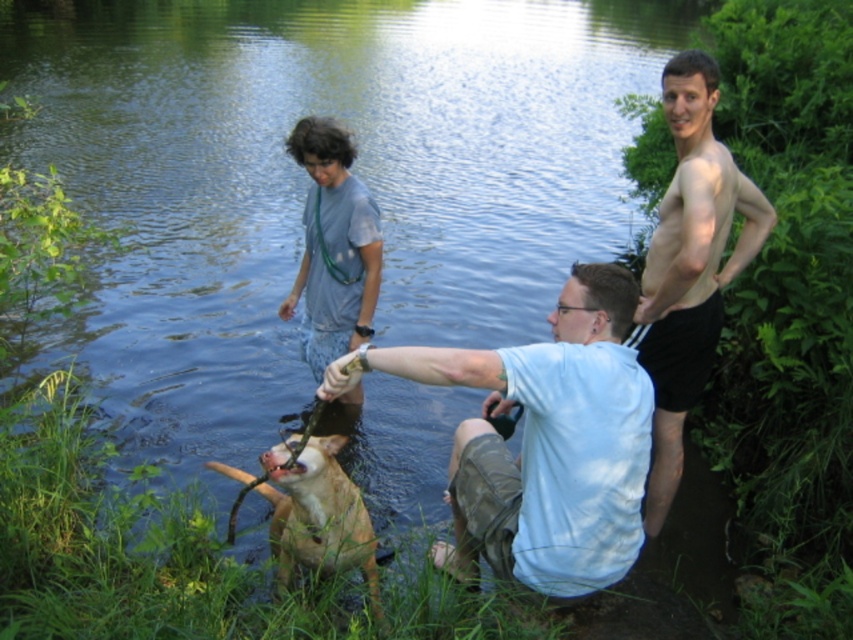
Can you confirm if light blue shirt at center is shorter than skinny tan skin at right?

Yes, light blue shirt at center is shorter than skinny tan skin at right.

Measure the distance between point (599, 554) and camera.

Point (599, 554) is 8.78 feet from camera.

Is point (648, 451) positioned behind point (682, 216)?

No, (648, 451) is in front of (682, 216).

Image resolution: width=853 pixels, height=640 pixels. In order to click on light blue shirt at center in this screenshot , I will do `click(548, 444)`.

Is light blue shirt at center further to camera compared to gray cotton shirt at center?

No.

Between point (456, 573) and point (331, 148), which one is positioned in front?

Positioned in front is point (456, 573).

Which is in front, point (556, 579) or point (358, 312)?

Point (556, 579) is more forward.

Locate an element on the screen. This screenshot has height=640, width=853. light blue shirt at center is located at coordinates (548, 444).

Between skinny tan skin at right and gray cotton shirt at center, which one is positioned higher?

Positioned higher is gray cotton shirt at center.

Can you confirm if skinny tan skin at right is positioned above gray cotton shirt at center?

Incorrect, skinny tan skin at right is not positioned above gray cotton shirt at center.

Does point (660, 77) lie behind point (355, 346)?

That is True.

This screenshot has height=640, width=853. Identify the location of skinny tan skin at right. (689, 266).